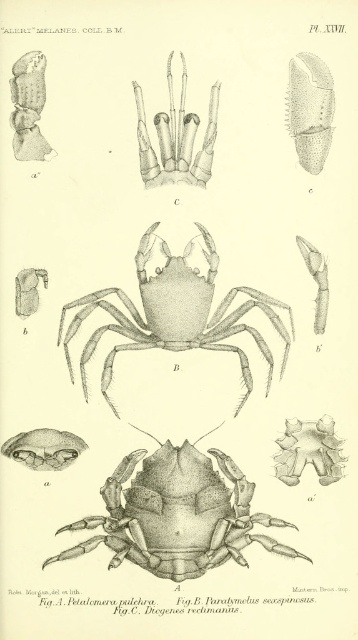
You are a biologist examining the scientific illustration of crabs. You notice two elements labeled as the serrated brown claw at upper right and the matte gray insect at upper left. Based on their sizes in the illustration, which one do you think is more likely to be the actual crab species depicted in Figure B?

The serrated brown claw at upper right is bigger than the matte gray insect at upper left, so the serrated brown claw at upper right is more likely to be part of the actual crab species in Figure B since it is larger and crabs typically have larger claws compared to insects.

You are a biologist examining the scientific illustration of crabs. You notice the serrated brown claw at upper right and the matte gray insect at upper left. Which object has a greater width according to the illustration?

The serrated brown claw at upper right has a greater width than the matte gray insect at upper left.